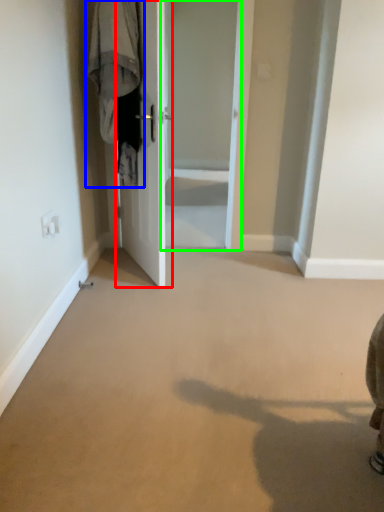
Question: Which object is the farthest from door (highlighted by a red box)? Choose among these: laundry (highlighted by a blue box) or screen door (highlighted by a green box).

Choices:
 (A) laundry
 (B) screen door

Answer: (B)